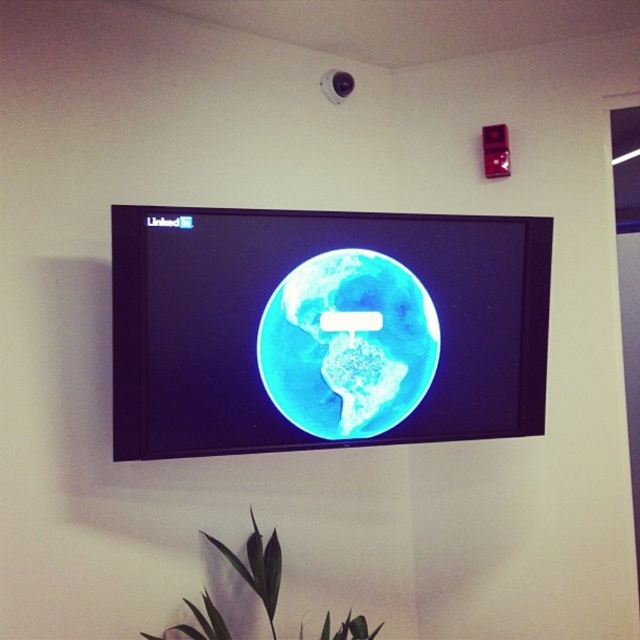
Question: Which object is positioned farthest from the green matte leaf at lower center?

Choices:
 (A) blue glossy globe at center
 (B) blue matte earth at center

Answer: (A)

Question: Considering the relative positions of blue glossy globe at center and blue matte earth at center in the image provided, where is blue glossy globe at center located with respect to blue matte earth at center?

Choices:
 (A) right
 (B) left

Answer: (B)

Question: Which of the following is the closest to the observer?

Choices:
 (A) (332, 358)
 (B) (360, 620)

Answer: (B)

Question: In this image, where is blue glossy globe at center located relative to green matte leaf at lower center?

Choices:
 (A) above
 (B) below

Answer: (A)

Question: Can you confirm if blue matte earth at center is bigger than green matte leaf at lower center?

Choices:
 (A) yes
 (B) no

Answer: (B)

Question: Which object appears closest to the camera in this image?

Choices:
 (A) blue matte earth at center
 (B) green matte leaf at lower center
 (C) blue glossy globe at center

Answer: (C)